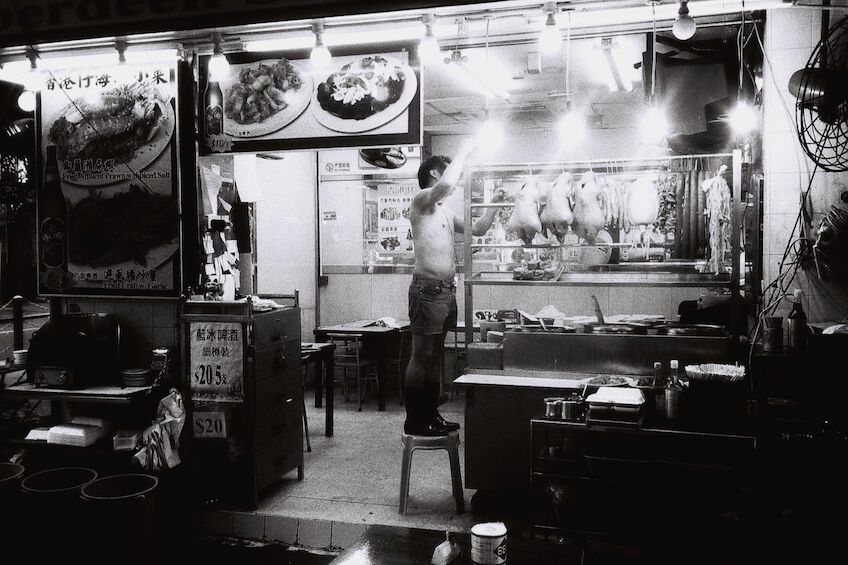
Locate an element on the screen. fan is located at coordinates (819, 91).